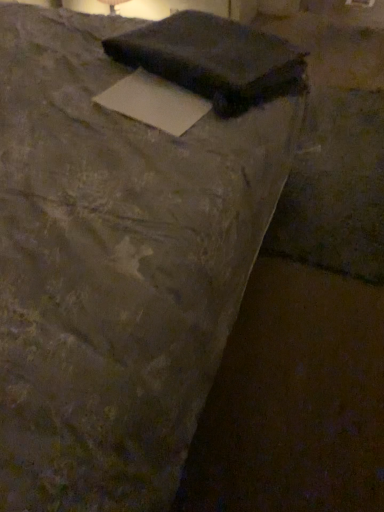
Describe the element at coordinates (214, 59) in the screenshot. Image resolution: width=384 pixels, height=512 pixels. I see `matte black laptop at upper center, which ranks as the 1th writing in top-to-bottom order` at that location.

Identify the location of matte black laptop at upper center, which ranks as the 1th writing in top-to-bottom order. (214, 59).

What is the approximate width of white paper at center, marked as the 1th writing in a bottom-to-top arrangement?

It is 8.51 inches.

What do you see at coordinates (154, 102) in the screenshot? The image size is (384, 512). I see `white paper at center, marked as the 1th writing in a bottom-to-top arrangement` at bounding box center [154, 102].

You are a GUI agent. You are given a task and a screenshot of the screen. Output one action in this format:
    pyautogui.click(x=<x>, y=<y>)
    Task: Click on the white paper at center, the second writing from the top
    The image size is (384, 512).
    Given the screenshot: What is the action you would take?
    pyautogui.click(x=154, y=102)

Image resolution: width=384 pixels, height=512 pixels. Find the location of `matte black laptop at upper center, which ranks as the 1th writing in top-to-bottom order`. matte black laptop at upper center, which ranks as the 1th writing in top-to-bottom order is located at coordinates click(x=214, y=59).

In the image, is white paper at center, the second writing from the top, on the left side or the right side of matte black laptop at upper center, which ranks as the 1th writing in top-to-bottom order?

Clearly, white paper at center, the second writing from the top, is on the left of matte black laptop at upper center, which ranks as the 1th writing in top-to-bottom order, in the image.

Considering the positions of objects white paper at center, the second writing from the top, and matte black laptop at upper center, which ranks as the 1th writing in top-to-bottom order, in the image provided, who is in front, white paper at center, the second writing from the top, or matte black laptop at upper center, which ranks as the 1th writing in top-to-bottom order,?

white paper at center, the second writing from the top, is in front.

Does point (142, 116) appear closer or farther from the camera than point (204, 93)?

Point (142, 116) is positioned closer to the camera compared to point (204, 93).

From the image's perspective, is white paper at center, the second writing from the top, over matte black laptop at upper center, which is the second writing from bottom to top?

No.

From a real-world perspective, is white paper at center, marked as the 1th writing in a bottom-to-top arrangement, above or below matte black laptop at upper center, which is the second writing from bottom to top?

white paper at center, marked as the 1th writing in a bottom-to-top arrangement, is situated lower than matte black laptop at upper center, which is the second writing from bottom to top, in the real world.

Looking at their sizes, would you say white paper at center, marked as the 1th writing in a bottom-to-top arrangement, is wider or thinner than matte black laptop at upper center, which is the second writing from bottom to top?

Considering their sizes, white paper at center, marked as the 1th writing in a bottom-to-top arrangement, looks slimmer than matte black laptop at upper center, which is the second writing from bottom to top.

In terms of height, does white paper at center, the second writing from the top, look taller or shorter compared to matte black laptop at upper center, which is the second writing from bottom to top?

In the image, white paper at center, the second writing from the top, appears to be shorter than matte black laptop at upper center, which is the second writing from bottom to top.

Can you confirm if white paper at center, marked as the 1th writing in a bottom-to-top arrangement, is smaller than matte black laptop at upper center, which is the second writing from bottom to top?

Correct, white paper at center, marked as the 1th writing in a bottom-to-top arrangement, occupies less space than matte black laptop at upper center, which is the second writing from bottom to top.

Can we say white paper at center, marked as the 1th writing in a bottom-to-top arrangement, lies outside matte black laptop at upper center, which ranks as the 1th writing in top-to-bottom order?

Yes, white paper at center, marked as the 1th writing in a bottom-to-top arrangement, is located beyond the bounds of matte black laptop at upper center, which ranks as the 1th writing in top-to-bottom order.

Can you see white paper at center, the second writing from the top, touching matte black laptop at upper center, which is the second writing from bottom to top?

white paper at center, the second writing from the top, is not next to matte black laptop at upper center, which is the second writing from bottom to top, and they're not touching.

Is white paper at center, the second writing from the top, oriented away from matte black laptop at upper center, which is the second writing from bottom to top?

No, matte black laptop at upper center, which is the second writing from bottom to top, is not at the back of white paper at center, the second writing from the top.

Measure the distance between white paper at center, the second writing from the top, and matte black laptop at upper center, which is the second writing from bottom to top.

white paper at center, the second writing from the top, is 6.45 inches from matte black laptop at upper center, which is the second writing from bottom to top.

In order to click on writing above the white paper at center, marked as the 1th writing in a bottom-to-top arrangement (from the image's perspective) in this screenshot , I will do [214, 59].

Considering the positions of objects matte black laptop at upper center, which ranks as the 1th writing in top-to-bottom order, and white paper at center, the second writing from the top, in the image provided, who is more to the right, matte black laptop at upper center, which ranks as the 1th writing in top-to-bottom order, or white paper at center, the second writing from the top,?

Positioned to the right is matte black laptop at upper center, which ranks as the 1th writing in top-to-bottom order.

Is the position of matte black laptop at upper center, which ranks as the 1th writing in top-to-bottom order, less distant than that of white paper at center, the second writing from the top?

No.

Does point (117, 42) lie behind point (181, 88)?

Yes, it is.

In the scene shown: From the image's perspective, relative to white paper at center, marked as the 1th writing in a bottom-to-top arrangement, is matte black laptop at upper center, which ranks as the 1th writing in top-to-bottom order, above or below?

matte black laptop at upper center, which ranks as the 1th writing in top-to-bottom order, is above white paper at center, marked as the 1th writing in a bottom-to-top arrangement.

From a real-world perspective, which is physically above, matte black laptop at upper center, which is the second writing from bottom to top, or white paper at center, the second writing from the top?

matte black laptop at upper center, which is the second writing from bottom to top.

Which of these two, matte black laptop at upper center, which ranks as the 1th writing in top-to-bottom order, or white paper at center, marked as the 1th writing in a bottom-to-top arrangement, is thinner?

With smaller width is white paper at center, marked as the 1th writing in a bottom-to-top arrangement.

Is matte black laptop at upper center, which ranks as the 1th writing in top-to-bottom order, taller or shorter than white paper at center, the second writing from the top?

matte black laptop at upper center, which ranks as the 1th writing in top-to-bottom order, is taller than white paper at center, the second writing from the top.

Considering the relative sizes of matte black laptop at upper center, which ranks as the 1th writing in top-to-bottom order, and white paper at center, marked as the 1th writing in a bottom-to-top arrangement, in the image provided, is matte black laptop at upper center, which ranks as the 1th writing in top-to-bottom order, smaller than white paper at center, marked as the 1th writing in a bottom-to-top arrangement,?

Incorrect, matte black laptop at upper center, which ranks as the 1th writing in top-to-bottom order, is not smaller in size than white paper at center, marked as the 1th writing in a bottom-to-top arrangement.

Is white paper at center, the second writing from the top, surrounded by matte black laptop at upper center, which is the second writing from bottom to top?

Definitely not — white paper at center, the second writing from the top, is not inside matte black laptop at upper center, which is the second writing from bottom to top.

In the scene shown: Are matte black laptop at upper center, which is the second writing from bottom to top, and white paper at center, marked as the 1th writing in a bottom-to-top arrangement, far apart?

That's not correct — matte black laptop at upper center, which is the second writing from bottom to top, is a little close to white paper at center, marked as the 1th writing in a bottom-to-top arrangement.

Is matte black laptop at upper center, which ranks as the 1th writing in top-to-bottom order, facing towards white paper at center, marked as the 1th writing in a bottom-to-top arrangement?

No, matte black laptop at upper center, which ranks as the 1th writing in top-to-bottom order, is not turned towards white paper at center, marked as the 1th writing in a bottom-to-top arrangement.

In order to click on writing below the matte black laptop at upper center, which is the second writing from bottom to top (from the image's perspective) in this screenshot , I will do tap(154, 102).

In the image, there is a white paper at center, the second writing from the top. Find the location of `writing above it (from the image's perspective)`. writing above it (from the image's perspective) is located at coordinates (214, 59).

This screenshot has width=384, height=512. I want to click on writing that is on the right side of white paper at center, marked as the 1th writing in a bottom-to-top arrangement, so click(214, 59).